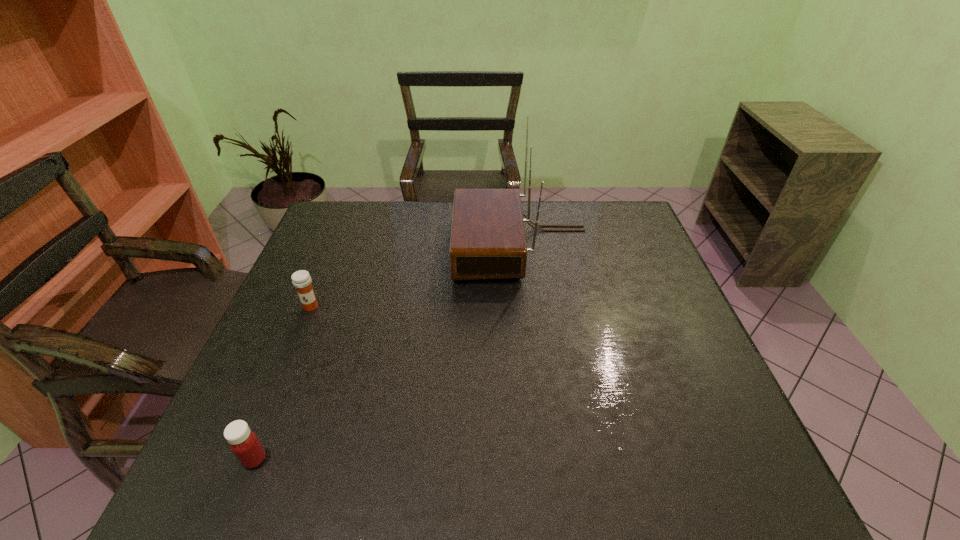
Find the location of a particular element. vacant space in between the nearer medicine and the farthest object is located at coordinates (388, 353).

You are a GUI agent. You are given a task and a screenshot of the screen. Output one action in this format:
    pyautogui.click(x=<x>, y=<y>)
    Task: Click on the free space between the nearest object and the tallest object
    Image resolution: width=960 pixels, height=540 pixels.
    Given the screenshot: What is the action you would take?
    pyautogui.click(x=388, y=353)

The height and width of the screenshot is (540, 960). In order to click on vacant space that's between the farther medicine and the nearer medicine in this screenshot , I will do `click(282, 383)`.

I want to click on free area in between the rightmost object and the nearer medicine, so click(x=388, y=353).

This screenshot has height=540, width=960. I want to click on free area in between the tallest object and the second nearest object, so click(417, 276).

The image size is (960, 540). Identify the location of free space between the nearest object and the farthest object. coord(388,353).

Locate an element on the screen. This screenshot has width=960, height=540. vacant point located between the farther medicine and the radio_receiver is located at coordinates (417, 276).

Locate an element on the screen. free space that is in between the nearest object and the second nearest object is located at coordinates (282, 383).

Image resolution: width=960 pixels, height=540 pixels. In order to click on the second closest object relative to the second farthest object in this screenshot , I will do `click(244, 443)`.

Identify which object is located as the second nearest to the nearer medicine. Please provide its 2D coordinates. Your answer should be formatted as a tuple, i.e. [(x, y)], where the tuple contains the x and y coordinates of a point satisfying the conditions above.

[(488, 241)]